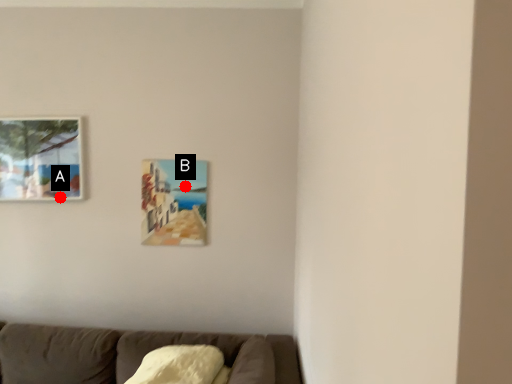
Question: Two points are circled on the image, labeled by A and B beside each circle. Which point appears closest to the camera in this image?

Choices:
 (A) A is closer
 (B) B is closer

Answer: (B)